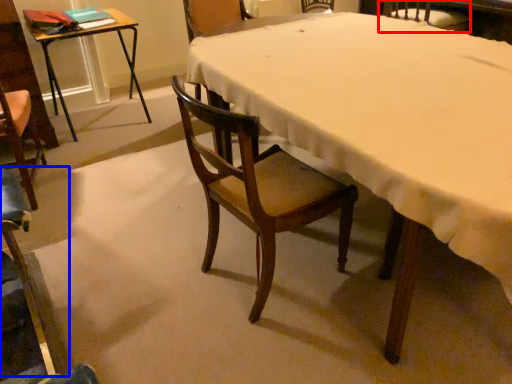
Question: Which of the following is the closest to the observer, chair (highlighted by a red box) or chair (highlighted by a blue box)?

Choices:
 (A) chair
 (B) chair

Answer: (B)